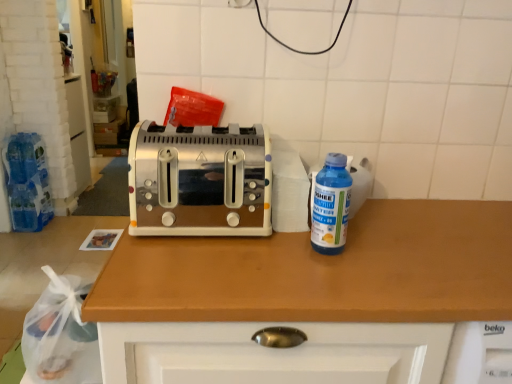
Question: Looking at their shapes, would you say satin silver toaster at center is wider or thinner than blue plastic bottle at right?

Choices:
 (A) wide
 (B) thin

Answer: (A)

Question: Considering their positions, is satin silver toaster at center located in front of or behind blue plastic bottle at right?

Choices:
 (A) behind
 (B) front

Answer: (A)

Question: Which is nearer to the satin silver toaster at center?

Choices:
 (A) wooden countertop at center
 (B) blue plastic bottle at right

Answer: (A)

Question: Which of these objects is positioned farthest from the blue plastic bottle at right?

Choices:
 (A) wooden countertop at center
 (B) satin silver toaster at center

Answer: (B)